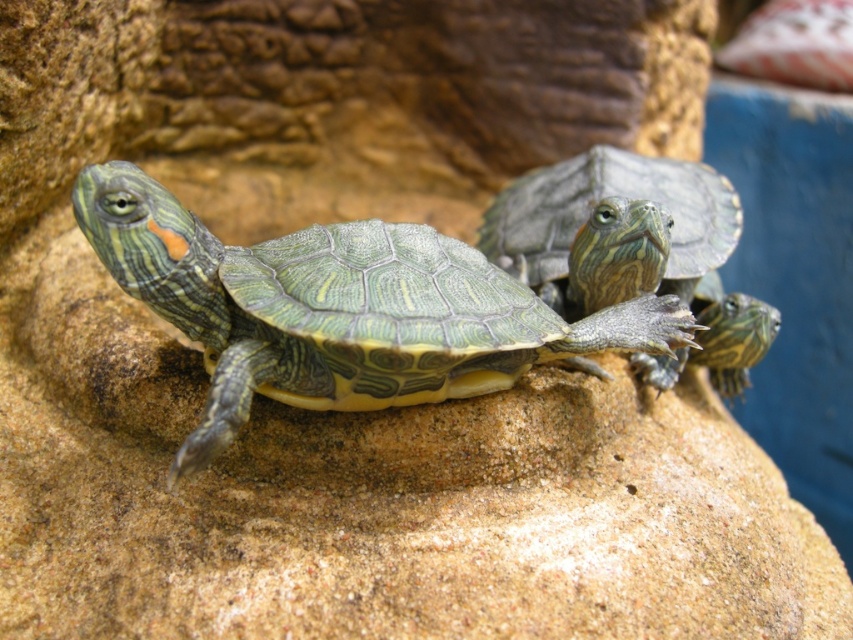
Can you confirm if green scaly turtle at center is bigger than green textured shell at center?

Actually, green scaly turtle at center might be smaller than green textured shell at center.

This screenshot has width=853, height=640. What are the coordinates of `green scaly turtle at center` in the screenshot? It's located at (339, 308).

What do you see at coordinates (339, 308) in the screenshot? I see `green scaly turtle at center` at bounding box center [339, 308].

The width and height of the screenshot is (853, 640). I want to click on green scaly turtle at center, so click(x=339, y=308).